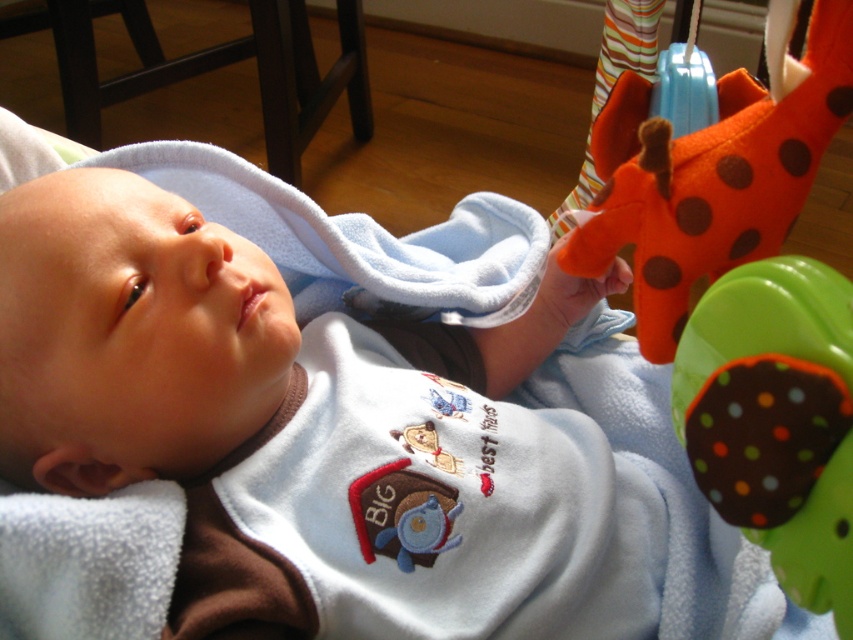
Question: Among these objects, which one is farthest from the camera?

Choices:
 (A) green fabric teether at right
 (B) orange felt giraffe at upper right
 (C) soft blue blanket at center

Answer: (C)

Question: Does soft blue blanket at center appear on the left side of green fabric teether at right?

Choices:
 (A) yes
 (B) no

Answer: (A)

Question: Is green fabric teether at right wider than orange felt giraffe at upper right?

Choices:
 (A) yes
 (B) no

Answer: (B)

Question: Which object is positioned closest to the orange felt giraffe at upper right?

Choices:
 (A) green fabric teether at right
 (B) soft blue blanket at center

Answer: (A)

Question: Is soft blue blanket at center further to the viewer compared to orange felt giraffe at upper right?

Choices:
 (A) no
 (B) yes

Answer: (B)

Question: Which point is farther from the camera taking this photo?

Choices:
 (A) (746, 323)
 (B) (207, 312)

Answer: (B)